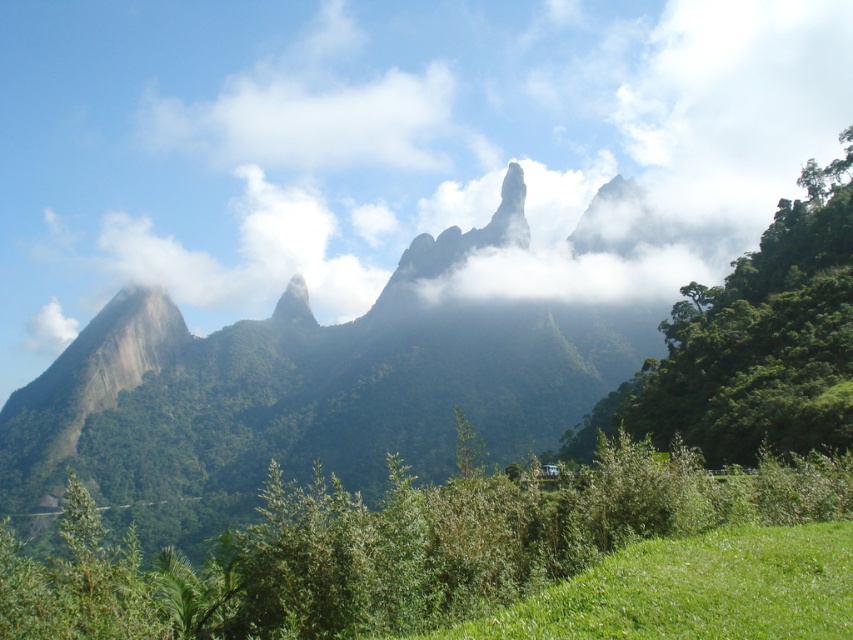
Between white fluffy cloud at upper center and smooth granite peak at center, which one appears on the right side from the viewer's perspective?

white fluffy cloud at upper center

Which of these two, white fluffy cloud at upper center or smooth granite peak at center, stands shorter?

smooth granite peak at center is shorter.

Image resolution: width=853 pixels, height=640 pixels. What do you see at coordinates (392, 148) in the screenshot? I see `white fluffy cloud at upper center` at bounding box center [392, 148].

The width and height of the screenshot is (853, 640). In order to click on white fluffy cloud at upper center in this screenshot , I will do `click(392, 148)`.